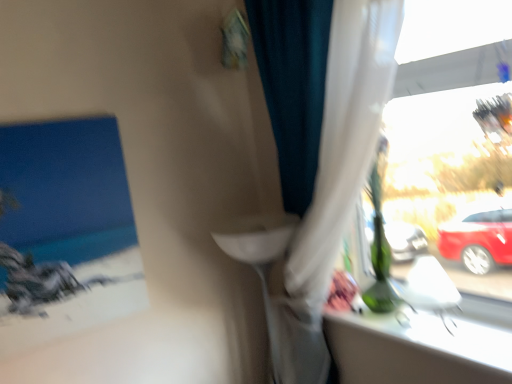
Question: Is white sheer curtain at right aimed at white glossy window sill at upper right?

Choices:
 (A) yes
 (B) no

Answer: (A)

Question: From a real-world perspective, does white sheer curtain at right stand above white glossy window sill at upper right?

Choices:
 (A) no
 (B) yes

Answer: (B)

Question: Does white sheer curtain at right appear on the right side of white glossy window sill at upper right?

Choices:
 (A) yes
 (B) no

Answer: (B)

Question: Considering the relative sizes of white sheer curtain at right and white glossy window sill at upper right in the image provided, is white sheer curtain at right thinner than white glossy window sill at upper right?

Choices:
 (A) no
 (B) yes

Answer: (B)

Question: Is white sheer curtain at right at the left side of white glossy window sill at upper right?

Choices:
 (A) yes
 (B) no

Answer: (A)

Question: From the image's perspective, is white sheer curtain at right beneath white glossy window sill at upper right?

Choices:
 (A) yes
 (B) no

Answer: (B)

Question: Does white glossy window sill at upper right appear on the left side of white sheer curtain at right?

Choices:
 (A) yes
 (B) no

Answer: (B)

Question: Can you confirm if white glossy window sill at upper right is taller than white sheer curtain at right?

Choices:
 (A) yes
 (B) no

Answer: (B)

Question: From a real-world perspective, is white glossy window sill at upper right positioned under white sheer curtain at right based on gravity?

Choices:
 (A) yes
 (B) no

Answer: (A)

Question: Can you confirm if white glossy window sill at upper right is bigger than white sheer curtain at right?

Choices:
 (A) no
 (B) yes

Answer: (A)

Question: Can you confirm if white glossy window sill at upper right is smaller than white sheer curtain at right?

Choices:
 (A) no
 (B) yes

Answer: (B)

Question: Is white glossy window sill at upper right located outside white sheer curtain at right?

Choices:
 (A) yes
 (B) no

Answer: (A)

Question: Is point (334, 110) positioned closer to the camera than point (508, 352)?

Choices:
 (A) farther
 (B) closer

Answer: (A)